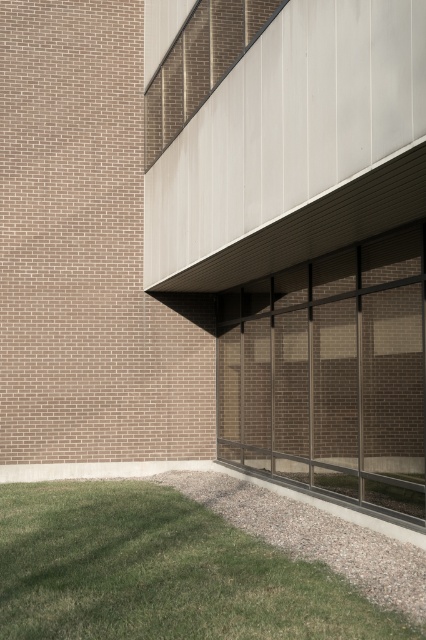
You are a window installer assessing the building facade. You need to determine if the clear glass windows at center can accommodate a new air conditioning unit that requires 1.2 square meters of space. Given the size comparison with the green grass at lower left, can you confirm if there is enough space?

The clear glass windows at center is larger in size than green grass at lower left. Since the green grass at lower left is not specified in size, but the windows are larger, it is possible the windows have sufficient space for the AC unit. However, exact dimensions are needed for confirmation.

You are standing in front of the building and want to look at the clear glass windows at center. Which direction should you look relative to the green grass at lower left?

The clear glass windows at center is above the green grass at lower left, so you should look upward from the green grass at lower left to see the clear glass windows at center.